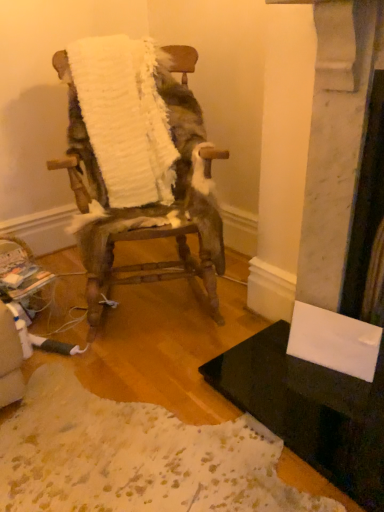
Question: From a real-world perspective, is black glossy table at lower right physically above white fluffy blanket at center?

Choices:
 (A) no
 (B) yes

Answer: (A)

Question: Could you tell me if black glossy table at lower right is turned towards white fluffy blanket at center?

Choices:
 (A) no
 (B) yes

Answer: (A)

Question: Considering the relative sizes of black glossy table at lower right and white fluffy blanket at center in the image provided, is black glossy table at lower right thinner than white fluffy blanket at center?

Choices:
 (A) no
 (B) yes

Answer: (A)

Question: Is black glossy table at lower right to the left of white fluffy blanket at center from the viewer's perspective?

Choices:
 (A) yes
 (B) no

Answer: (B)

Question: Considering the relative sizes of black glossy table at lower right and white fluffy blanket at center in the image provided, is black glossy table at lower right taller than white fluffy blanket at center?

Choices:
 (A) yes
 (B) no

Answer: (B)

Question: Is point (87, 136) positioned closer to the camera than point (112, 121)?

Choices:
 (A) farther
 (B) closer

Answer: (B)

Question: From a real-world perspective, relative to white fluffy blanket at center, is white fluffy chair at center vertically above or below?

Choices:
 (A) above
 (B) below

Answer: (B)

Question: Looking at the image, does white fluffy chair at center seem bigger or smaller compared to white fluffy blanket at center?

Choices:
 (A) small
 (B) big

Answer: (B)

Question: From the image's perspective, is white fluffy chair at center located above or below white fluffy blanket at center?

Choices:
 (A) below
 (B) above

Answer: (A)

Question: From the image's perspective, relative to black glossy table at lower right, is white fluffy chair at center above or below?

Choices:
 (A) below
 (B) above

Answer: (B)

Question: Does point (183, 106) appear closer or farther from the camera than point (354, 413)?

Choices:
 (A) farther
 (B) closer

Answer: (A)

Question: Is white fluffy chair at center wider or thinner than black glossy table at lower right?

Choices:
 (A) thin
 (B) wide

Answer: (B)

Question: From a real-world perspective, is white fluffy chair at center physically located above or below black glossy table at lower right?

Choices:
 (A) below
 (B) above

Answer: (B)

Question: Is black glossy table at lower right spatially inside white fluffy chair at center, or outside of it?

Choices:
 (A) outside
 (B) inside

Answer: (A)

Question: From a real-world perspective, is black glossy table at lower right positioned above or below white fluffy chair at center?

Choices:
 (A) below
 (B) above

Answer: (A)